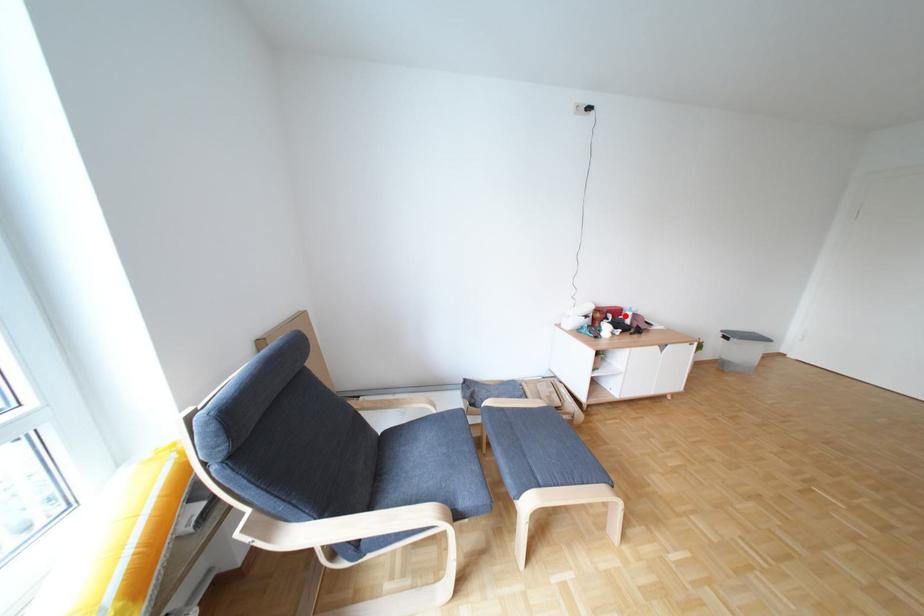
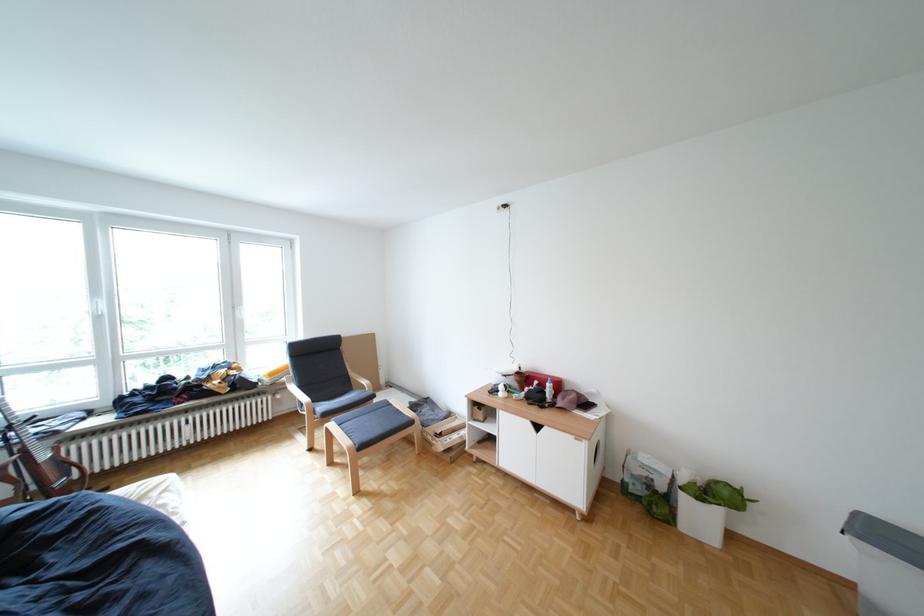
Question: I am providing you with two images of the same scene from different viewpoints. A red point is marked on the first image. Is the red point's position out of view in image 2?

Choices:
 (A) Yes
 (B) No

Answer: (B)